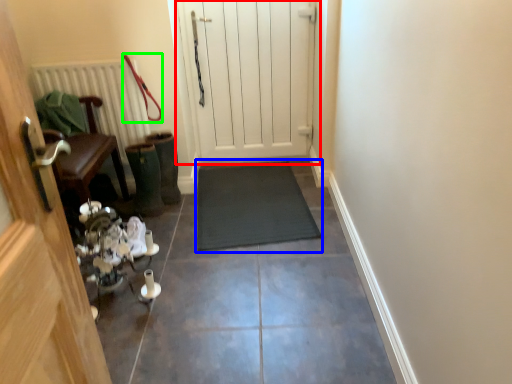
Question: Which is nearer to the door (highlighted by a red box)? doormat (highlighted by a blue box) or leash (highlighted by a green box).

Choices:
 (A) doormat
 (B) leash

Answer: (A)